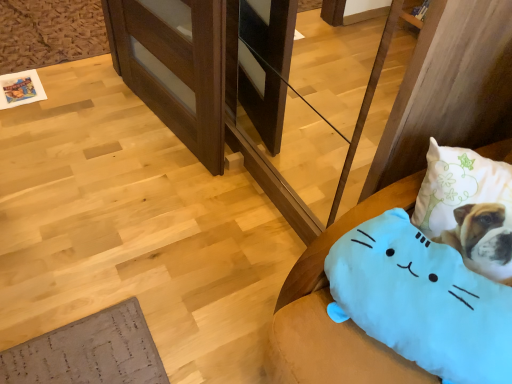
Question: Does blue plush cat at lower right have a lesser height compared to wooden at left?

Choices:
 (A) no
 (B) yes

Answer: (A)

Question: Does blue plush cat at lower right have a larger size compared to wooden at left?

Choices:
 (A) yes
 (B) no

Answer: (A)

Question: From a real-world perspective, is blue plush cat at lower right positioned over wooden at left based on gravity?

Choices:
 (A) no
 (B) yes

Answer: (B)

Question: Is blue plush cat at lower right thinner than wooden at left?

Choices:
 (A) no
 (B) yes

Answer: (A)

Question: Considering the relative sizes of blue plush cat at lower right and wooden at left in the image provided, is blue plush cat at lower right taller than wooden at left?

Choices:
 (A) no
 (B) yes

Answer: (B)

Question: Do you think wooden at left is within blue plush cat at lower right, or outside of it?

Choices:
 (A) inside
 (B) outside

Answer: (B)

Question: Relative to blue plush cat at lower right, is wooden at left in front or behind?

Choices:
 (A) front
 (B) behind

Answer: (B)

Question: Would you say wooden at left is to the left or to the right of blue plush cat at lower right in the picture?

Choices:
 (A) right
 (B) left

Answer: (B)

Question: Is wooden at left wider or thinner than blue plush cat at lower right?

Choices:
 (A) wide
 (B) thin

Answer: (B)

Question: In terms of height, does blue plush cat at lower right look taller or shorter compared to blue plush cat at lower right?

Choices:
 (A) tall
 (B) short

Answer: (B)

Question: Is blue plush cat at lower right wider or thinner than blue plush cat at lower right?

Choices:
 (A) wide
 (B) thin

Answer: (B)

Question: Is blue plush cat at lower right to the left or to the right of blue plush cat at lower right in the image?

Choices:
 (A) left
 (B) right

Answer: (B)

Question: Is blue plush cat at lower right situated inside blue plush cat at lower right or outside?

Choices:
 (A) outside
 (B) inside

Answer: (A)

Question: Relative to blue plush cat at lower right, is blue plush cat at lower right in front or behind?

Choices:
 (A) behind
 (B) front

Answer: (A)

Question: Considering the positions of blue plush cat at lower right and blue plush cat at lower right in the image, is blue plush cat at lower right taller or shorter than blue plush cat at lower right?

Choices:
 (A) short
 (B) tall

Answer: (B)